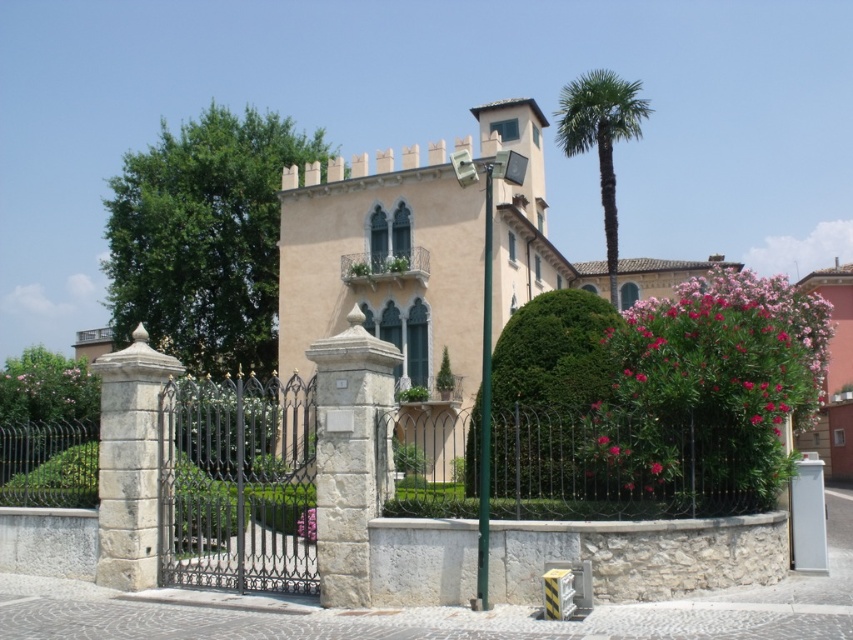
You are standing at the entrance of the building and want to take a photo that includes both the green leafy tree at upper left and the palm tree. Since the palm tree is closer to you, will you need to adjust your camera angle to include both in the frame?

The green leafy tree at upper left is 79.72 meters from viewer, so it is much farther away than the palm tree which is closer. To include both in the frame, you will need to adjust your camera angle to a wider view to capture both the distant green leafy tree at upper left and the closer palm tree.

You are standing at the entrance of the building and want to take a photo of the pink matte flower at center. Considering the distance, will you need to use a zoom lens to capture it clearly?

The pink matte flower at center is 99.03 feet away from the camera, so you will need to use a zoom lens to capture it clearly.